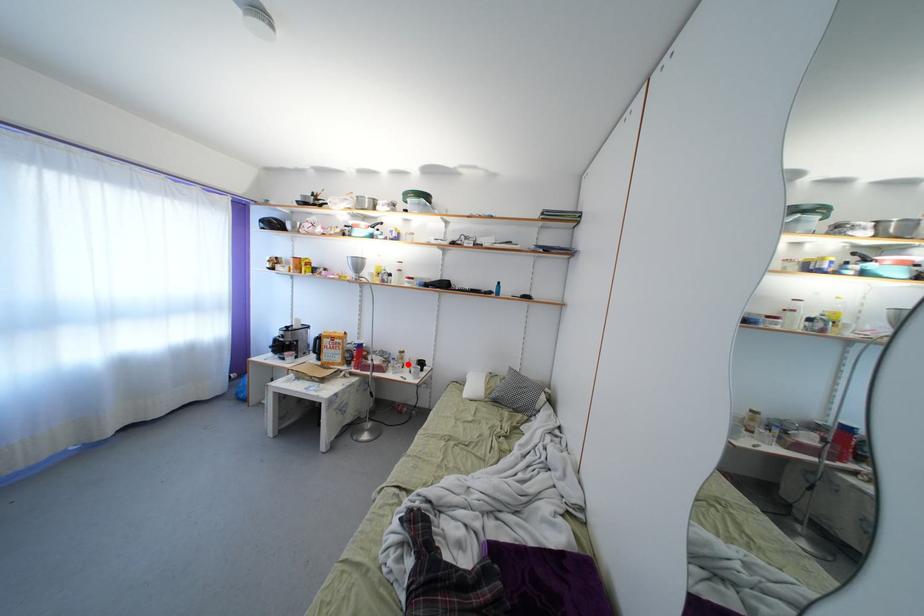
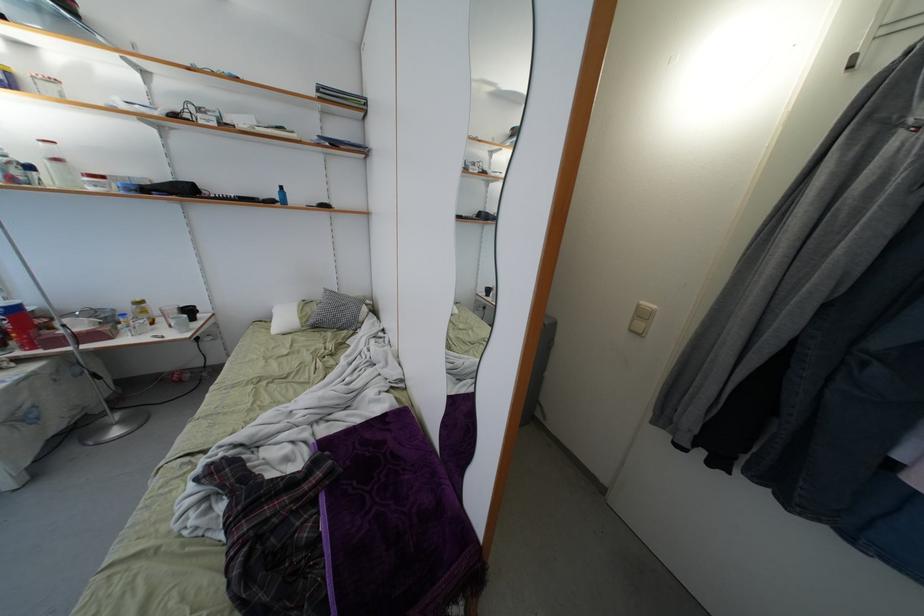
Where in the second image is the point corresponding to the highlighted location from the first image?

(149, 317)